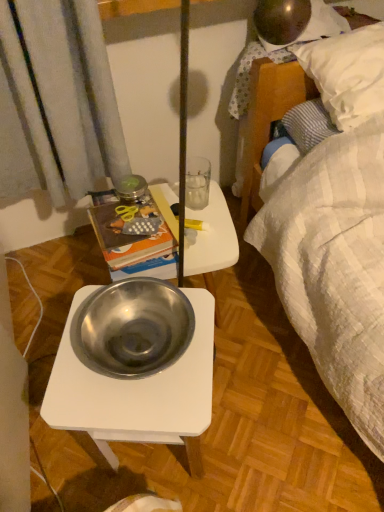
The width and height of the screenshot is (384, 512). Find the location of `free point in front of metallic silver bowl at center`. free point in front of metallic silver bowl at center is located at coordinates (248, 381).